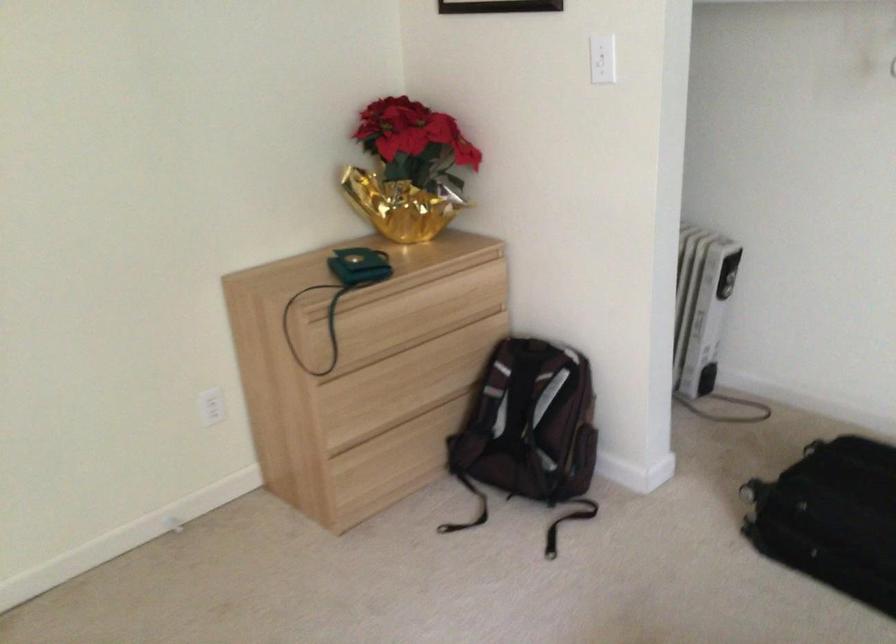
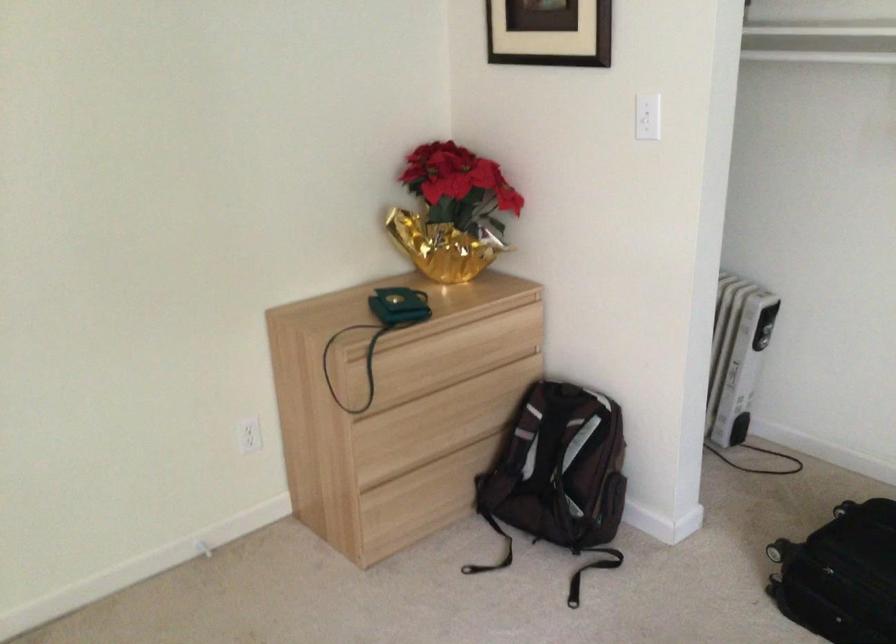
Locate, in the second image, the point that corresponds to (359,266) in the first image.

(399, 306)